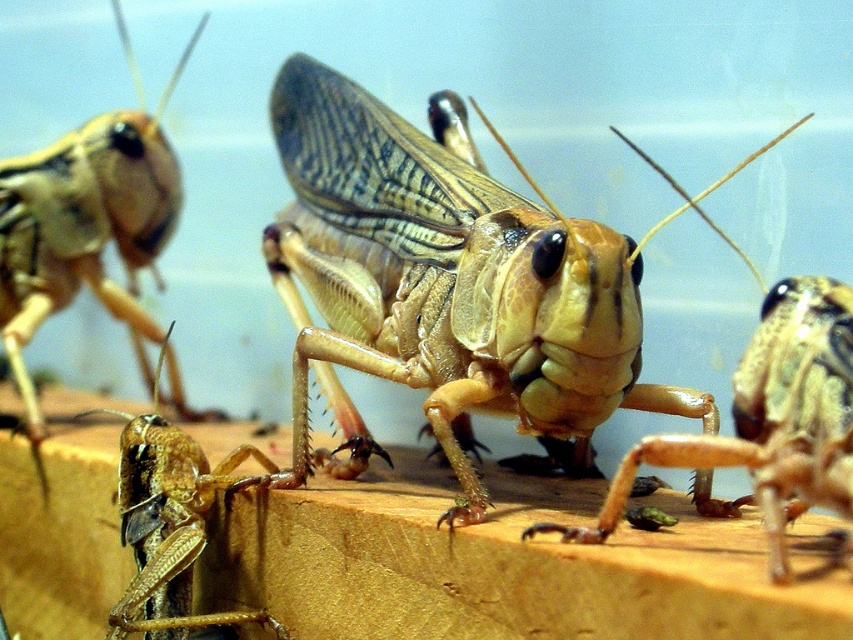
You are an entomologist examining the grasshoppers in the image. Which grasshopper, the translucent beige grasshopper at center or the brown matte grasshopper at lower left, is taller?

The translucent beige grasshopper at center is taller than the brown matte grasshopper at lower left according to the description.

You are an entomologist examining the grasshoppers. You notice the translucent beige grasshopper at center and the brown matte grasshopper at lower left. Which grasshopper is positioned to the right of the other?

The translucent beige grasshopper at center is to the right of the brown matte grasshopper at lower left.

You are an entomologist examining the grasshoppers in the image. You notice two points marked on the wooden surface where grasshoppers are located. The first point is at coordinates point (x=106, y=614), and the second is at point (x=460, y=234). Based on the depth of field effect, which point is closer to the camera?

Point (x=460, y=234) is closer to the camera because the description states that point (x=106, y=614) is behind point (x=460, y=234).